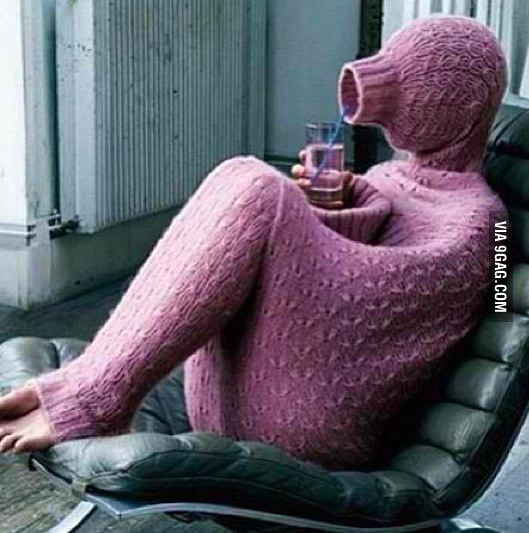
I want to click on chair, so click(470, 400).